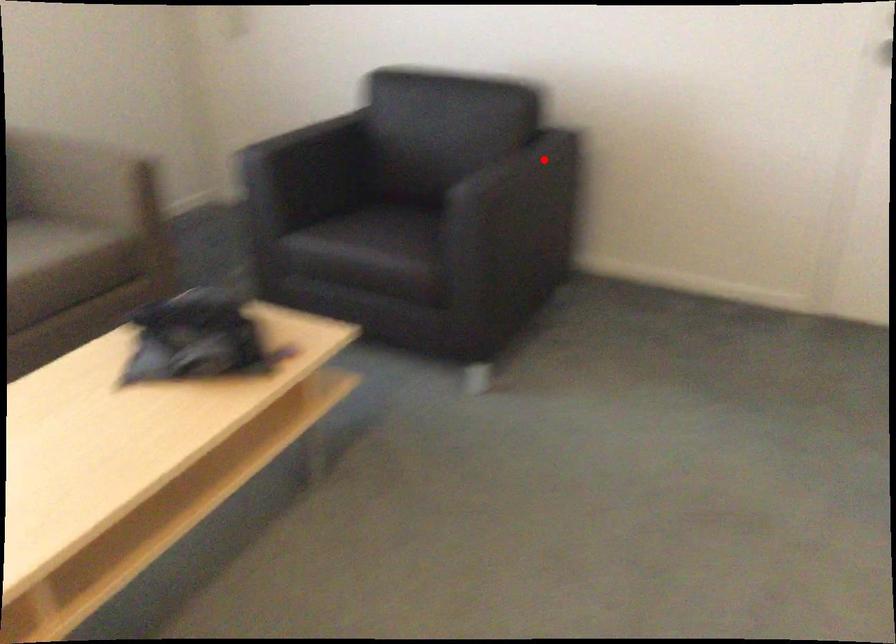
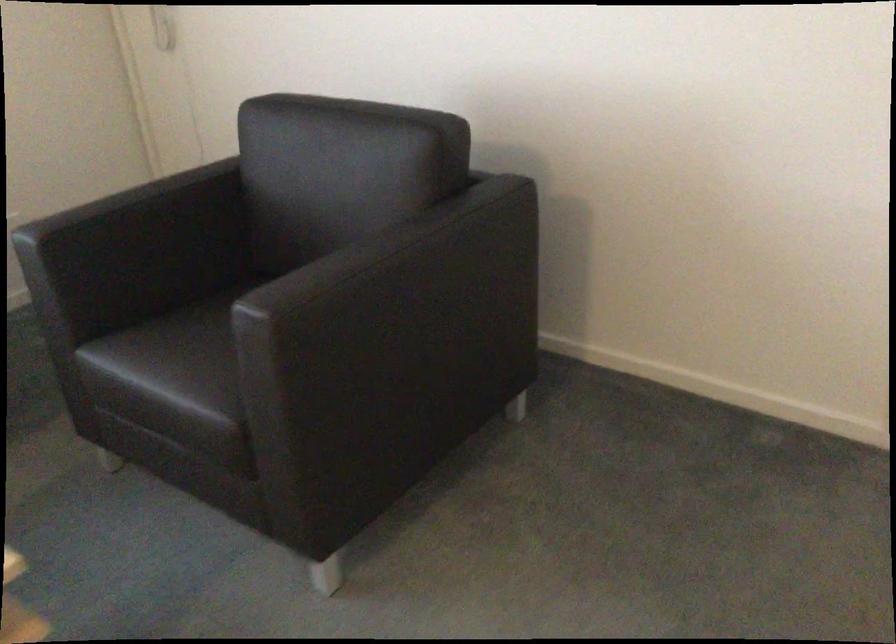
Find the pixel in the second image that matches the highlighted location in the first image.

(419, 249)